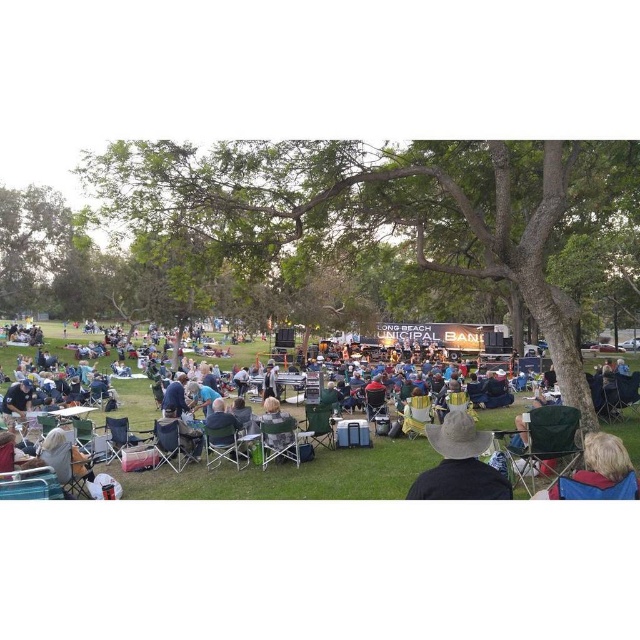
You are a photographer at the concert and want to capture a photo of the brown straw hat at center and the dark blue fabric chair at center. To ensure both are in focus, you need to know their positions relative to each other. Which object is closer to the camera?

The dark blue fabric chair at center is closer to the camera because the brown straw hat at center is behind it.

You are attending the outdoor concert and want to sit down on the brown straw hat at center. However, there is a dark blue fabric chair at center in the way. Can you sit on the hat without moving the chair?

The dark blue fabric chair at center is positioned over brown straw hat at center, so the hat is underneath the chair. You cannot sit on the hat without moving the chair.